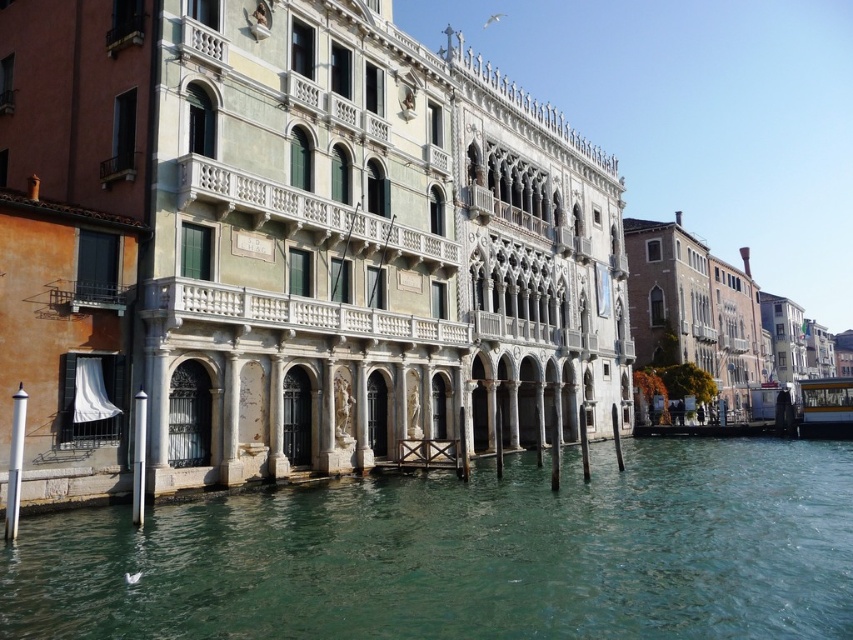
Question: Based on their relative distances, which object is farther from the white marble palace at center?

Choices:
 (A) greenish water at lower center
 (B) yellow-green plastic boat at lower right

Answer: (B)

Question: Does white marble palace at center appear under greenish water at lower center?

Choices:
 (A) yes
 (B) no

Answer: (B)

Question: Estimate the real-world distances between objects in this image. Which object is farther from the greenish water at lower center?

Choices:
 (A) yellow-green plastic boat at lower right
 (B) white marble palace at center

Answer: (A)

Question: Where is greenish water at lower center located in relation to yellow-green plastic boat at lower right in the image?

Choices:
 (A) right
 (B) left

Answer: (B)

Question: From the image, what is the correct spatial relationship of greenish water at lower center in relation to yellow-green plastic boat at lower right?

Choices:
 (A) above
 (B) below

Answer: (B)

Question: Estimate the real-world distances between objects in this image. Which object is closer to the white marble palace at center?

Choices:
 (A) greenish water at lower center
 (B) yellow-green plastic boat at lower right

Answer: (A)